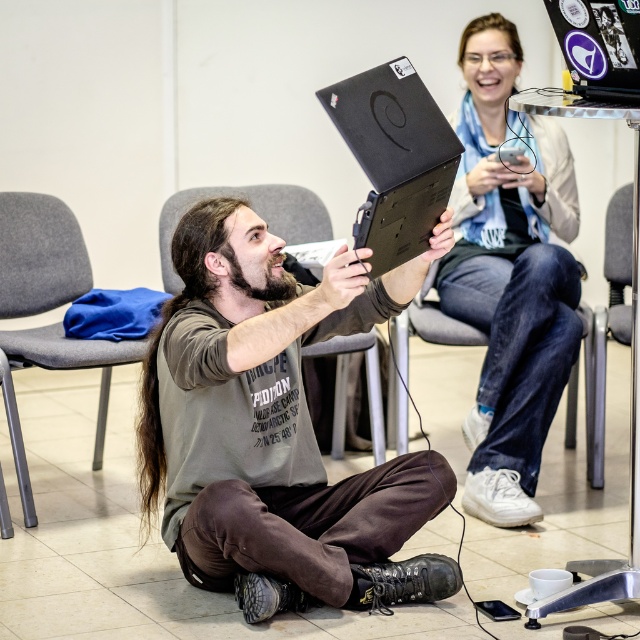
Which is behind, point (381, 192) or point (602, 472)?

Point (602, 472)

Can you confirm if black matte laptop at center is positioned below metallic gray chair at center?

Incorrect, black matte laptop at center is not positioned below metallic gray chair at center.

Is point (401, 60) behind point (596, 468)?

No, it is not.

Where is `black matte laptop at center`? The image size is (640, 640). black matte laptop at center is located at coordinates (394, 157).

Where is `matte black tablet at center`? The width and height of the screenshot is (640, 640). matte black tablet at center is located at coordinates (275, 422).

Which is in front, point (209, 336) or point (605, 77)?

Point (605, 77) is more forward.

Locate an element on the screen. The height and width of the screenshot is (640, 640). matte black tablet at center is located at coordinates (275, 422).

Which is more to the right, gray fabric chair at center or metallic gray chair at center?

Positioned to the right is metallic gray chair at center.

In the scene shown: Who is higher up, gray fabric chair at center or metallic gray chair at center?

gray fabric chair at center

Identify the location of gray fabric chair at center. The width and height of the screenshot is (640, 640). (256, 211).

The height and width of the screenshot is (640, 640). Find the location of `gray fabric chair at center`. gray fabric chair at center is located at coordinates (256, 211).